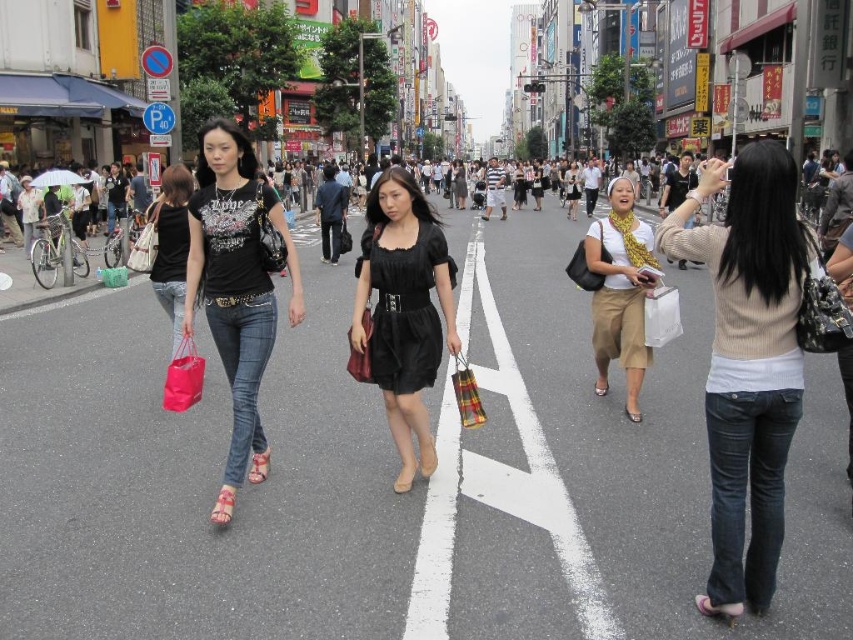
Question: Which object is farther from the camera taking this photo?

Choices:
 (A) matte black shirt at center
 (B) matte black tank top at left
 (C) black satin dress at center
 (D) matte beige sweater at center

Answer: (B)

Question: Estimate the real-world distances between objects in this image. Which object is closer to the matte beige sweater at center?

Choices:
 (A) white matte shopping bag at right
 (B) black satin dress at center

Answer: (A)

Question: Which point is closer to the camera?

Choices:
 (A) white matte shopping bag at right
 (B) matte beige sweater at center
 (C) white matte scarf at center

Answer: (B)

Question: Can you confirm if white matte scarf at center is bigger than matte black tank top at left?

Choices:
 (A) yes
 (B) no

Answer: (A)

Question: Does matte black shirt at center have a larger size compared to white matte scarf at center?

Choices:
 (A) yes
 (B) no

Answer: (B)

Question: Observing the image, what is the correct spatial positioning of matte black shirt at center in reference to matte black tank top at left?

Choices:
 (A) right
 (B) left

Answer: (A)